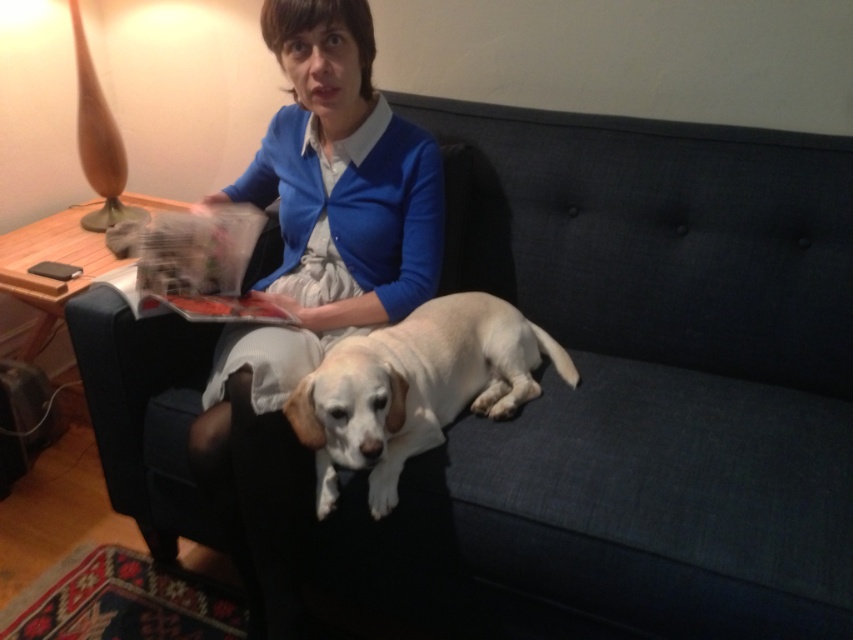
You are a guest in this living room and want to sit down without disturbing the dog. Which object, the white fur dog at center or the white fabric armchair at center, should you choose?

The white fur dog at center is below the white fabric armchair at center, so you should choose the white fabric armchair at center to sit on since it is an available seating option and the dog is resting on the sofa.